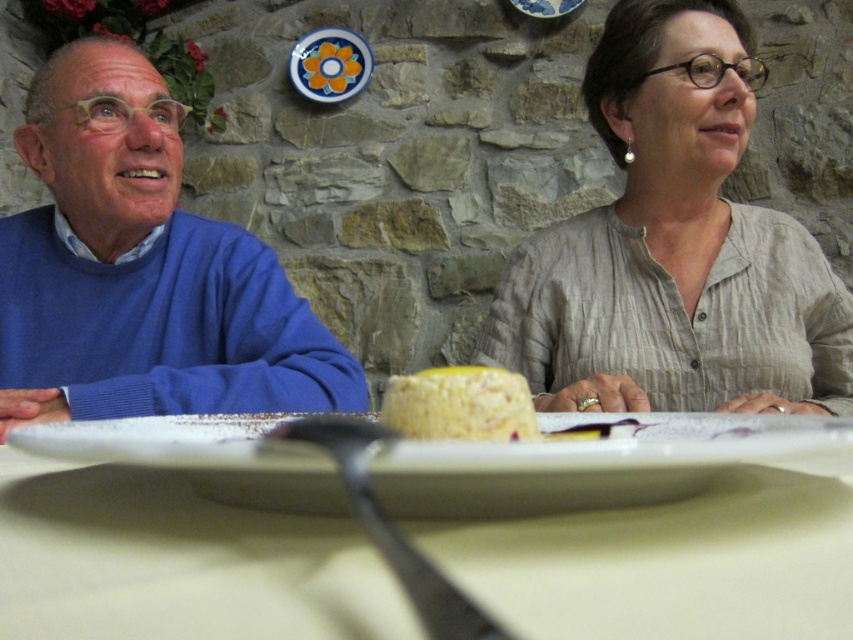
Please use the coordinates provided to determine whether the white matte plate at center is closer to the person on the left or the person on the right. The coordinates are based on the image frame with the origin at the bottom left corner.

The white matte plate at center is located at coordinates point (664,557). Since the origin is at the bottom left corner, the x coordinate of 0.872 indicates it is closer to the right side of the image frame, so it is closer to the person on the right.

You are a server who needs to place a large platter of food between the white matte plate at center and the porcelain plate at upper center. The platter requires at least 2 meters of space. Can you fit it there?

The distance between the white matte plate at center and the porcelain plate at upper center is 1.84 meters, which is less than the required 2 meters. Therefore, the platter cannot be placed there.

You are a waiter at the table. You need to place a new dessert menu between the matte blue sweater at left and the yellow sponge cake at center. Where should you place it?

The matte blue sweater at left is to the left of the yellow sponge cake at center, so you should place the dessert menu between them, to the right of the matte blue sweater at left and to the left of the yellow sponge cake at center.